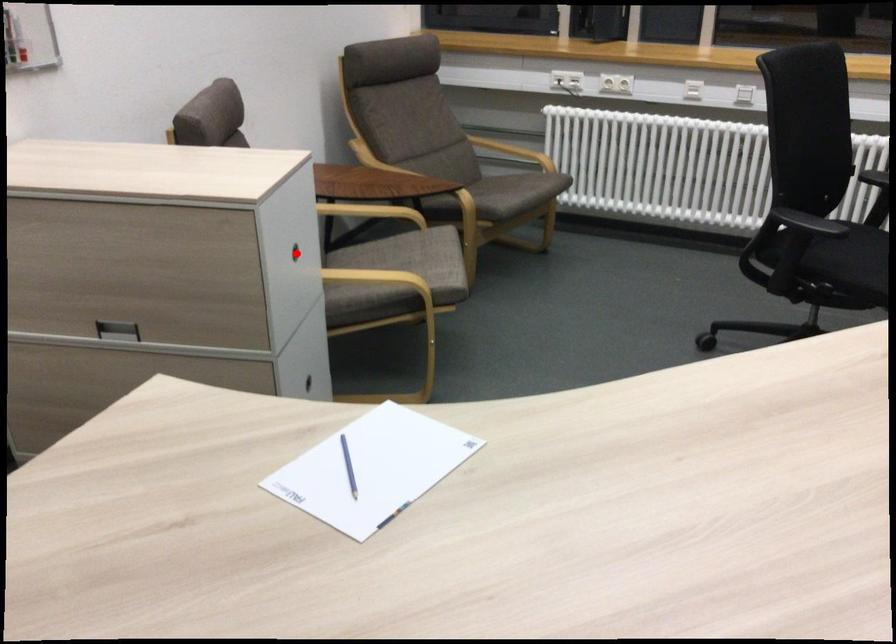
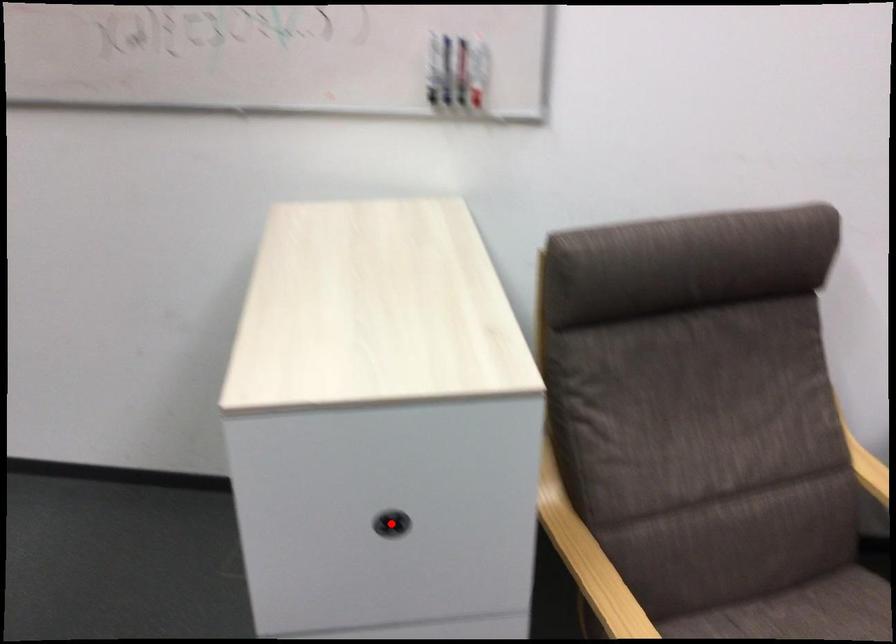
I am providing you with two images of the same scene from different viewpoints. A red point is marked on the first image and another point is marked on the second image. Do the highlighted points in image1 and image2 indicate the same real-world spot?

Yes